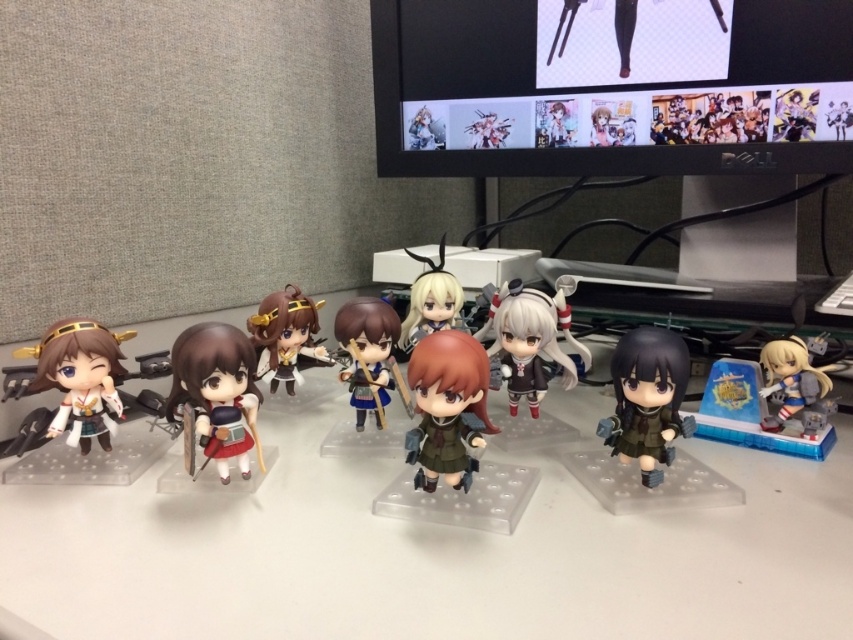
Question: Considering the relative positions of clear plastic table at center and matte black figure at lower right in the image provided, where is clear plastic table at center located with respect to matte black figure at lower right?

Choices:
 (A) below
 (B) above

Answer: (A)

Question: Which of the following is the closest to the observer?

Choices:
 (A) (526, 381)
 (B) (247, 424)
 (C) (657, 353)
 (D) (444, 300)

Answer: (C)

Question: Does black glossy monitor at upper center come behind white matte doll at center?

Choices:
 (A) no
 (B) yes

Answer: (B)

Question: Estimate the real-world distances between objects in this image. Which object is closer to the matte white figure at right?

Choices:
 (A) matte red skirt at center
 (B) matte blue fabric doll at center

Answer: (B)

Question: Which object appears closest to the camera in this image?

Choices:
 (A) matte black figure at lower right
 (B) black glossy monitor at upper center
 (C) matte white doll at center
 (D) white matte doll at center

Answer: (A)

Question: Where is matte gold hairpin at center located in relation to matte white doll at center in the image?

Choices:
 (A) right
 (B) left

Answer: (B)